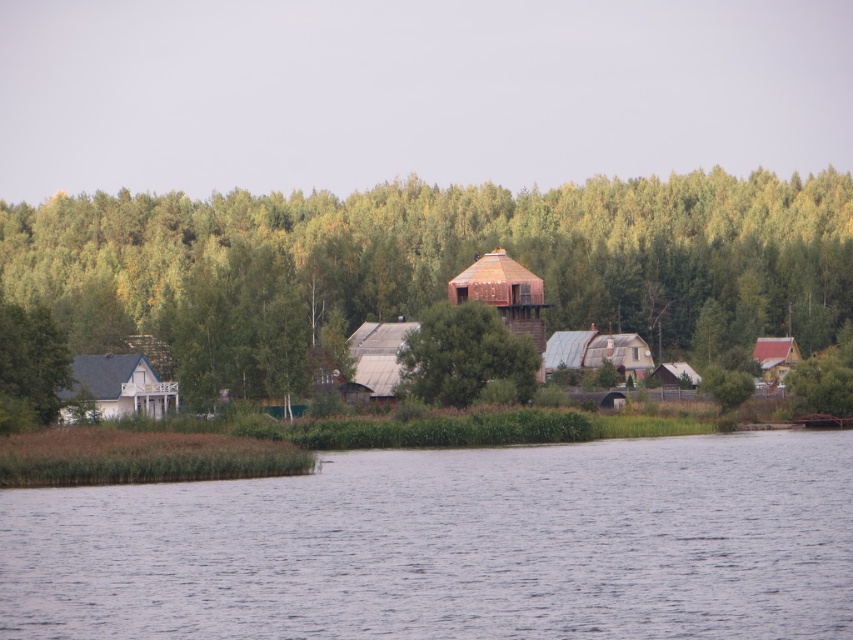
From the picture: You are planning to host a small gathering and need to choose between the white painted wood house at left and the brown wooden hut at lower right. Based on the scene description, which location offers more space for your event?

The white painted wood house at left has a larger size compared to the brown wooden hut at lower right, so it offers more space for the event.

Based on the photo, you are standing at the point with coordinates (115,388) in the image. Based on the scene description, what type of structure are you most likely near?

The point at (115,388) corresponds to a white painted wood house at left, so you are most likely near a white painted wood house at left.

You are standing at the edge of the lake looking towards the village. You see the green leafy forest at center and the brown wooden hut at lower right. Which object is higher in the image?

The green leafy forest at center is higher in the image because it is positioned above the brown wooden hut at lower right.